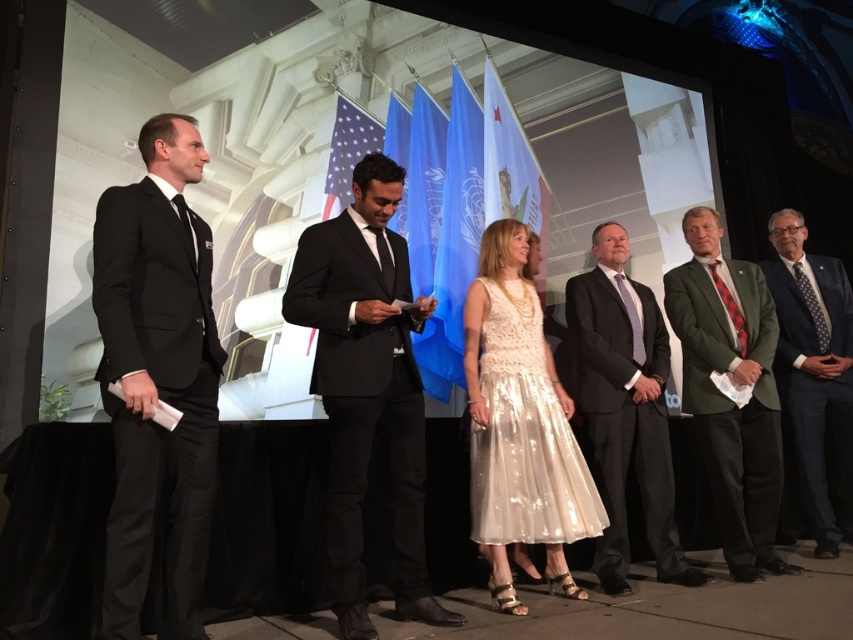
You are standing on the stage and need to move from the point at coordinates point (328, 563) to the point at coordinates point (552, 400). Which direction should you move in to get closer to your destination?

To move from point (328, 563) to point (552, 400), you should move towards the upper left direction since point (328, 563) is in front of point (552, 400), indicating that the destination is behind and to the left.

You are an event planner arranging seating for the stage. You need to place a chair for each attendee. The chairs are arranged in a row from left to right. According to the image, where should you place the chair for the person in the black matte suit at left relative to the chair for the person in the dark blue suit at right?

The black matte suit at left should be placed to the left of the dark blue suit at right because the black matte suit at left is positioned to the left of dark blue suit at right in the image.

You are standing at the point marked as point (347, 508) on the stage. You need to walk to the front of the stage, which is 5 meters away from your current position. Will you be able to reach the front without moving past the stage boundaries?

The point (347, 508) is 2.36 meters away from the viewer. Since the front of the stage is 5 meters away, you would need to move an additional 2.64 meters beyond your current position to reach it. However, the stage boundaries are not specified, so it is uncertain if there is enough space to move that far forward.